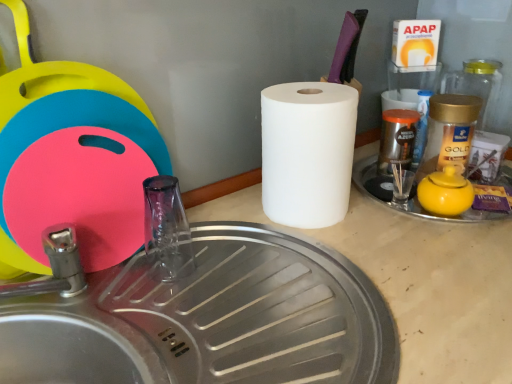
The image size is (512, 384). Identify the location of vacant space situated above brushed metal sink at lower left (from a real-world perspective). (222, 296).